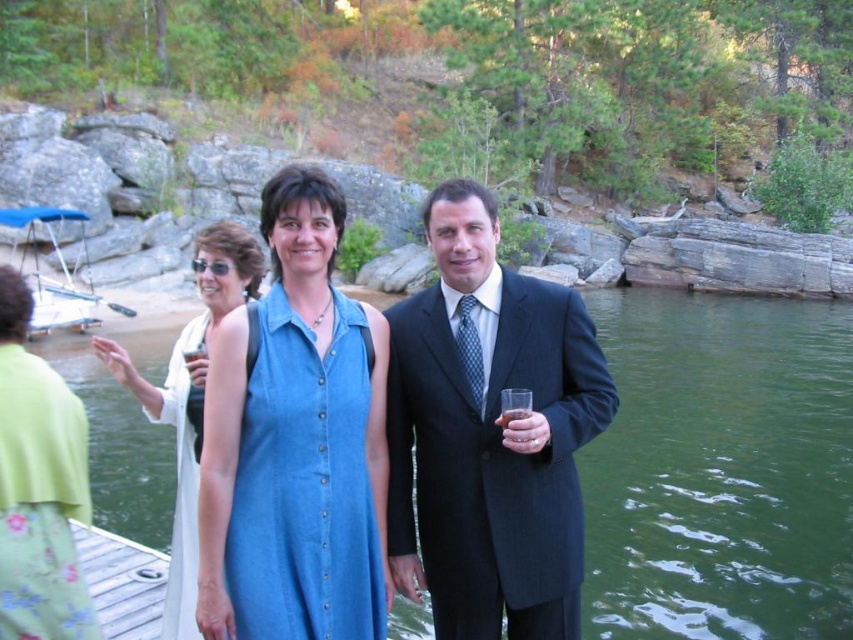
Question: In this image, where is denim dress at center located relative to light beige fabric dress at center?

Choices:
 (A) above
 (B) below

Answer: (B)

Question: Estimate the real-world distances between objects in this image. Which object is farther from the translucent glass at right?

Choices:
 (A) blue fabric boat at left
 (B) light beige fabric dress at center
 (C) blue denim dress at center

Answer: (A)

Question: Which point appears farthest from the camera in this image?

Choices:
 (A) (550, 298)
 (B) (231, 593)
 (C) (518, 413)
 (D) (38, 220)

Answer: (D)

Question: Is the position of blue fabric boat at left less distant than that of translucent glass at right?

Choices:
 (A) yes
 (B) no

Answer: (B)

Question: Does blue denim dress at center appear on the right side of translucent glass at right?

Choices:
 (A) yes
 (B) no

Answer: (B)

Question: Which object is positioned farthest from the dark blue pinstripe suit at center?

Choices:
 (A) blue fabric boat at left
 (B) blue denim dress at center
 (C) translucent glass at right
 (D) white satin dress at center

Answer: (A)